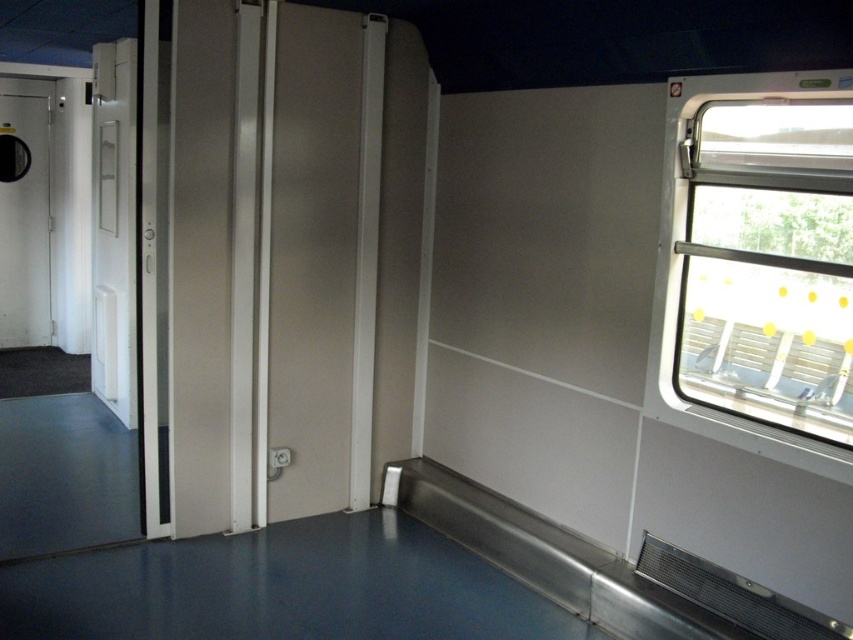
Does transparent glass window at right appear over matte black door at left?

Actually, transparent glass window at right is below matte black door at left.

Does transparent glass window at right come behind matte black door at left?

No, transparent glass window at right is in front of matte black door at left.

At what (x,y) coordinates should I click in order to perform the action: click on transparent glass window at right. Please return your answer as a coordinate pair (x, y). The image size is (853, 640). Looking at the image, I should click on (766, 262).

Can you confirm if white glossy door at left is positioned to the right of matte black door at left?

Yes, white glossy door at left is to the right of matte black door at left.

Is point (132, 269) more distant than point (20, 166)?

No, (132, 269) is in front of (20, 166).

Where is `white glossy door at left`? white glossy door at left is located at coordinates (113, 227).

Is transparent glass window at right in front of white glossy door at left?

Yes, it is in front of white glossy door at left.

Between point (837, 314) and point (97, 189), which one is positioned in front?

Point (837, 314) is more forward.

What do you see at coordinates (766, 262) in the screenshot?
I see `transparent glass window at right` at bounding box center [766, 262].

Locate an element on the screen. The height and width of the screenshot is (640, 853). transparent glass window at right is located at coordinates (766, 262).